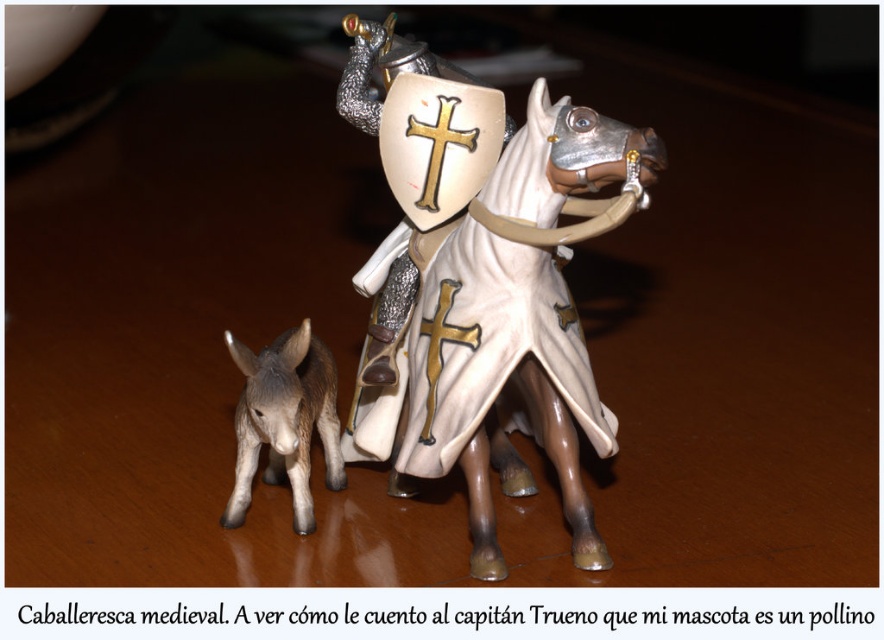
Is white glossy plastic horse at center positioned at the back of brown matte donkey at lower left?

No.

Is point (559, 372) farther from camera compared to point (341, 474)?

That is False.

Locate an element on the screen. white glossy plastic horse at center is located at coordinates (484, 285).

Locate an element on the screen. white glossy plastic horse at center is located at coordinates (484, 285).